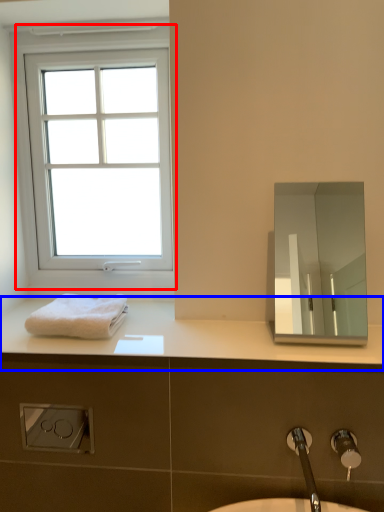
Question: Which object appears farthest to the camera in this image, window (highlighted by a red box) or counter top (highlighted by a blue box)?

Choices:
 (A) window
 (B) counter top

Answer: (A)